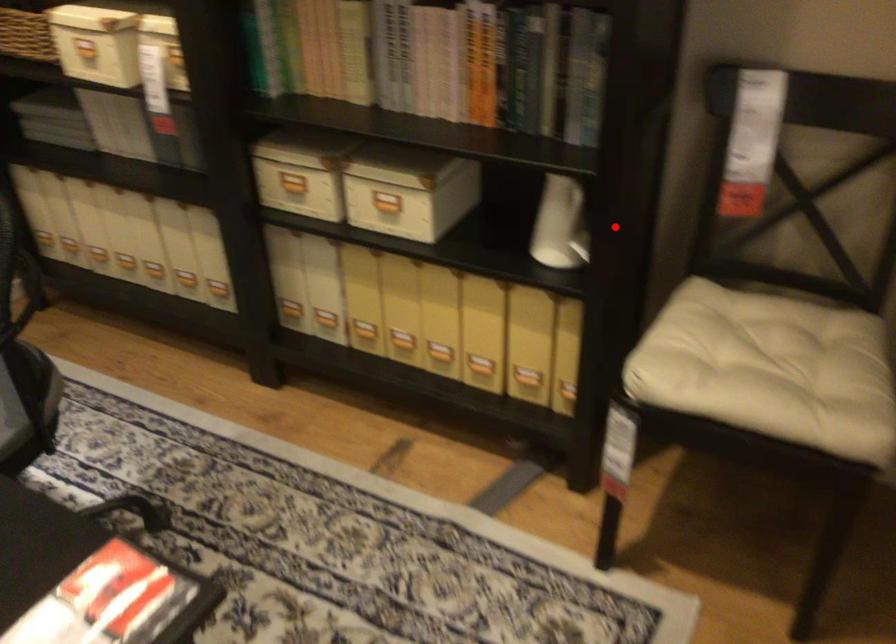
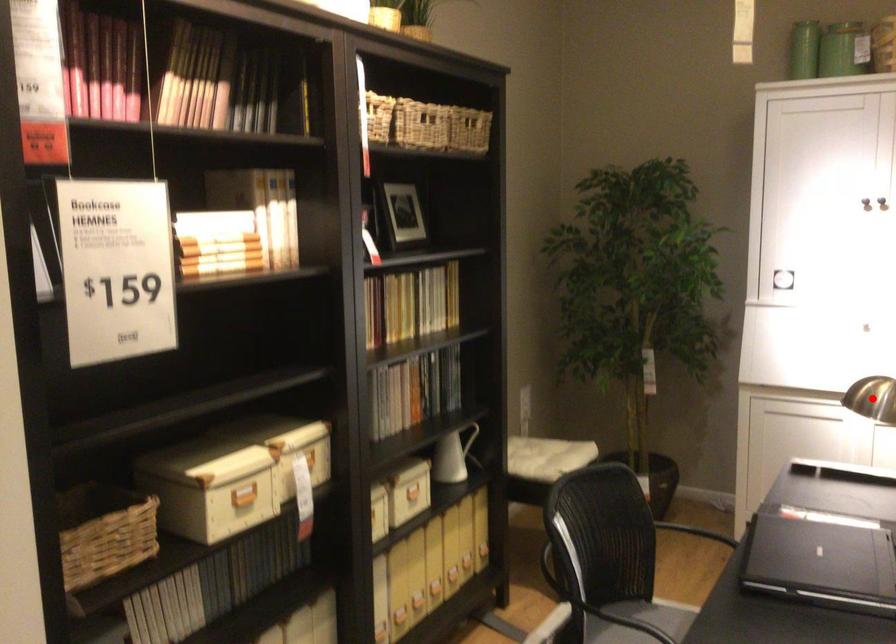
I am providing you with two images of the same scene from different viewpoints. A red point is marked on the first image and another point is marked on the second image. Do the highlighted points in image1 and image2 indicate the same real-world spot?

No